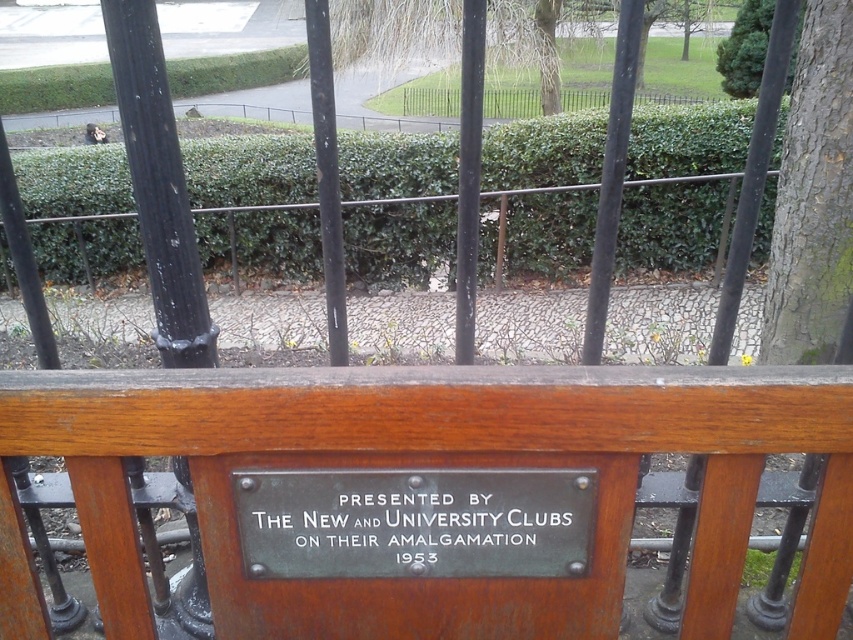
Image resolution: width=853 pixels, height=640 pixels. What do you see at coordinates (248, 170) in the screenshot?
I see `green leafy hedge at center` at bounding box center [248, 170].

Is green leafy hedge at center to the right of green leafy tree at upper right from the viewer's perspective?

No, green leafy hedge at center is not to the right of green leafy tree at upper right.

At what (x,y) coordinates should I click in order to perform the action: click on green leafy hedge at center. Please return your answer as a coordinate pair (x, y). Looking at the image, I should click on (248, 170).

Is point (824, 564) farther from viewer compared to point (833, 308)?

No, it is in front of (833, 308).

Is wooden bench at center below green rough bark tree at right?

Indeed, wooden bench at center is positioned under green rough bark tree at right.

Find the location of a particular element. wooden bench at center is located at coordinates (445, 465).

The height and width of the screenshot is (640, 853). I want to click on wooden bench at center, so click(445, 465).

Is wooden bench at center below green patina plaque at center?

Actually, wooden bench at center is above green patina plaque at center.

Measure the distance from wooden bench at center to green patina plaque at center.

wooden bench at center is 4.43 inches from green patina plaque at center.

Describe the element at coordinates (445, 465) in the screenshot. I see `wooden bench at center` at that location.

Where is `wooden bench at center`? wooden bench at center is located at coordinates (445, 465).